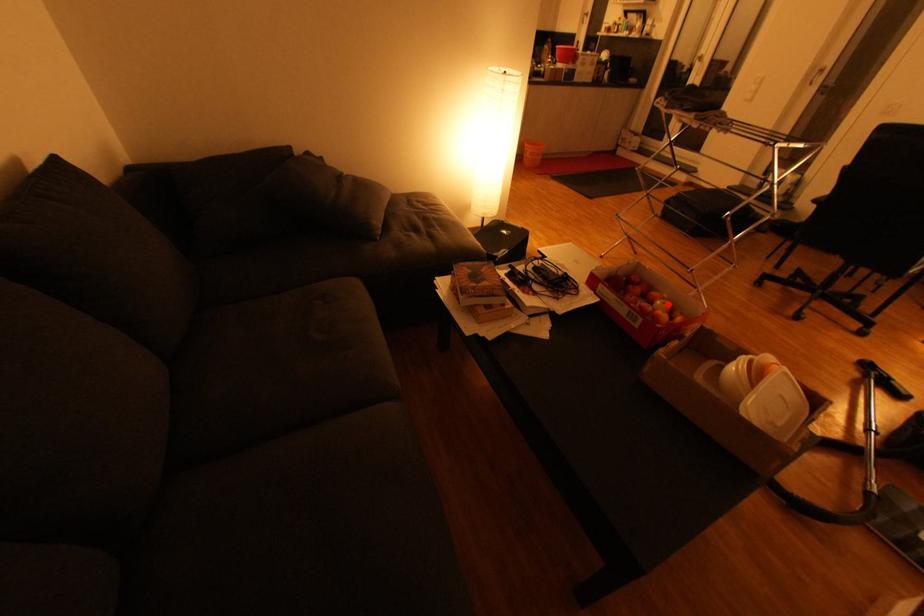
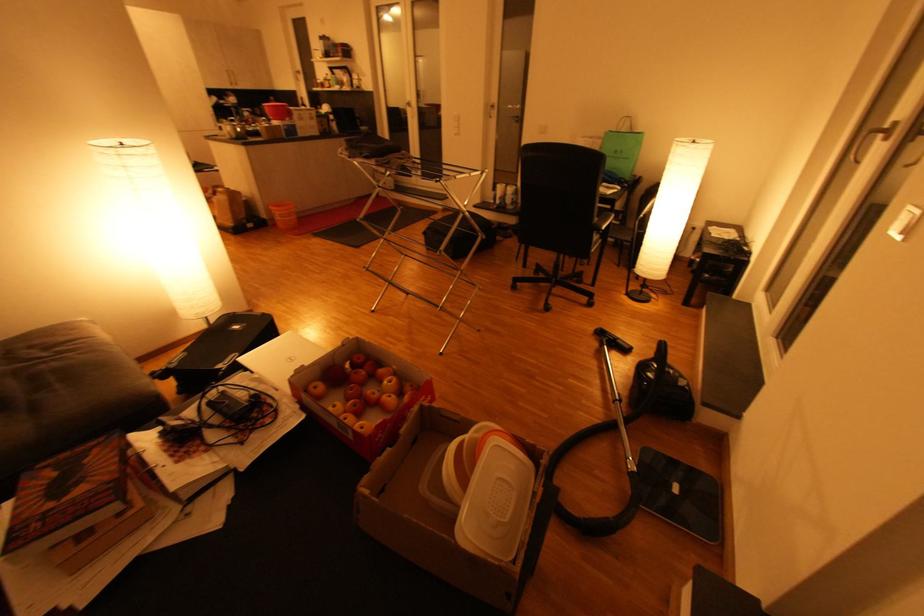
Where in the second image is the point corresponding to the highlighted location from the first image?

(395, 382)